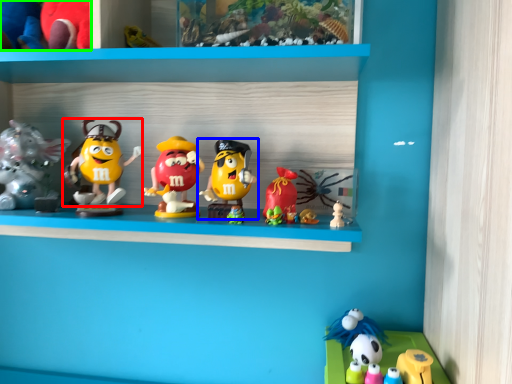
Question: Which object is the farthest from toy (highlighted by a red box)? Choose among these: toy (highlighted by a blue box) or toy (highlighted by a green box).

Choices:
 (A) toy
 (B) toy

Answer: (B)